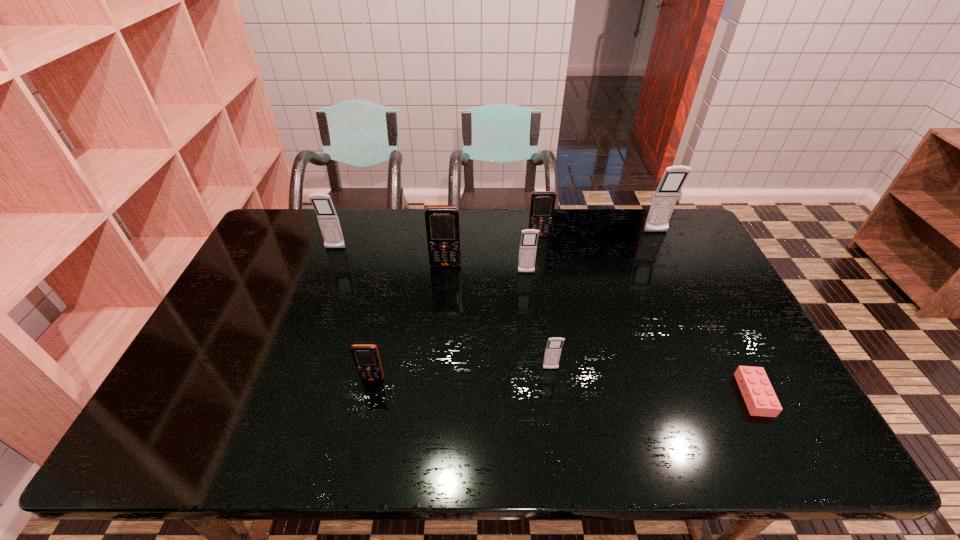
In the image, there is a desktop. Identify the location of vacant space at the right edge. This screenshot has height=540, width=960. (699, 265).

Where is `free region at the far left corner`? free region at the far left corner is located at coordinates (289, 210).

Locate an element on the screen. The height and width of the screenshot is (540, 960). free area in between the fifth cellular telephone from right to left and the second farthest gray cellular telephone is located at coordinates (391, 257).

Locate an element on the screen. free space between the nearest gray cellular telephone and the leftmost cellular telephone is located at coordinates (443, 309).

Find the location of a particular element. This screenshot has height=540, width=960. unoccupied area between the second nearest orange cellular telephone and the biggest gray cellular telephone is located at coordinates (551, 249).

The width and height of the screenshot is (960, 540). Identify the location of blank region between the second orange cellular telephone from left to right and the pink Lego. (600, 330).

Locate an element on the screen. This screenshot has height=540, width=960. vacant region between the second smallest gray cellular telephone and the tallest cellular telephone is located at coordinates (591, 253).

This screenshot has width=960, height=540. What are the coordinates of `empty location between the third object from left to right and the second biggest orange cellular telephone` in the screenshot? It's located at (492, 251).

Image resolution: width=960 pixels, height=540 pixels. I want to click on free spot between the rightmost orange cellular telephone and the farthest gray cellular telephone, so click(598, 234).

You are a GUI agent. You are given a task and a screenshot of the screen. Output one action in this format:
    pyautogui.click(x=<x>, y=<y>)
    Task: Click on the unoccupied position between the sixth farthest cellular telephone and the pink Lego
    
    Given the screenshot: What is the action you would take?
    (x=652, y=382)